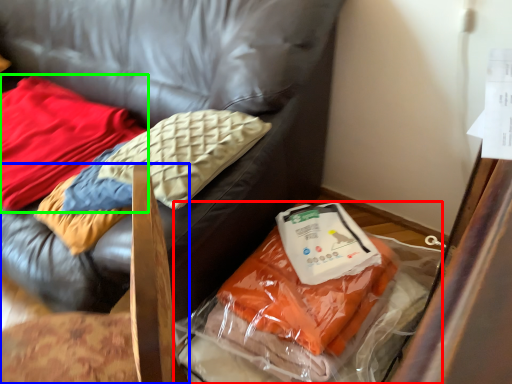
Question: Which object is positioned closest to waste (highlighted by a red box)? Select from furniture (highlighted by a blue box) and pillow (highlighted by a green box).

Choices:
 (A) furniture
 (B) pillow

Answer: (A)